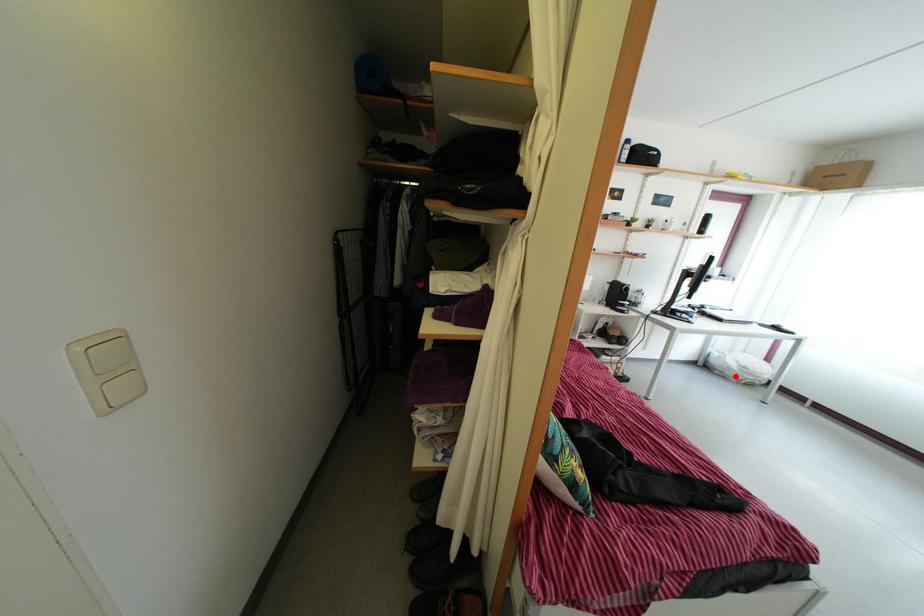
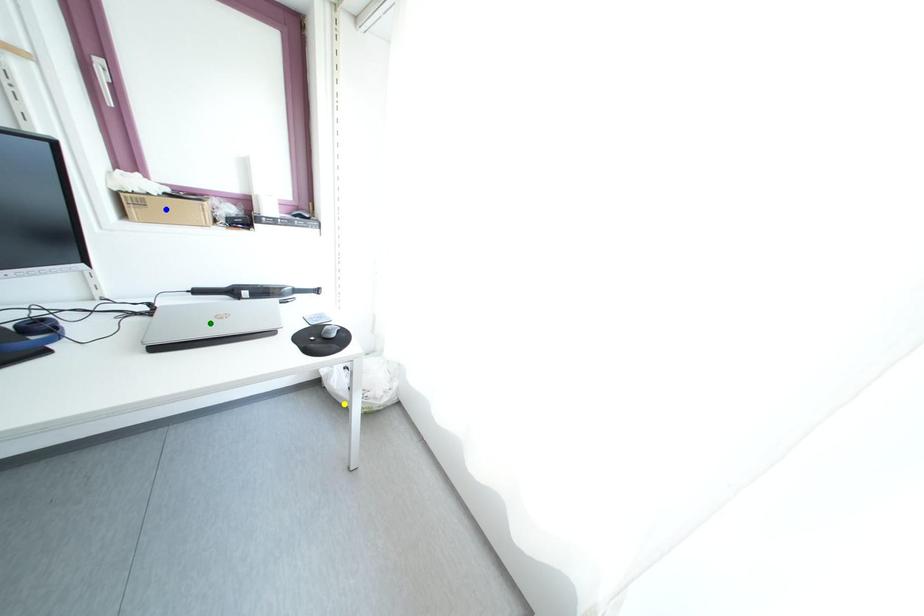
Question: I am providing you with two images of the same scene from different viewpoints. A red point is marked on the first image. You are given multiple points on the second image. Which point in image 2 represents the same 3d spot as the red point in image 1?

Choices:
 (A) green point
 (B) blue point
 (C) yellow point

Answer: (C)